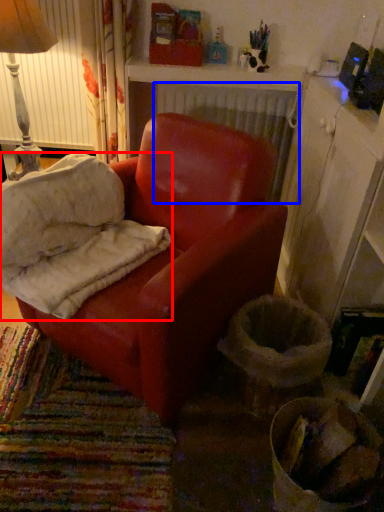
Question: Which object is further to the camera taking this photo, material (highlighted by a red box) or radiator (highlighted by a blue box)?

Choices:
 (A) material
 (B) radiator

Answer: (B)